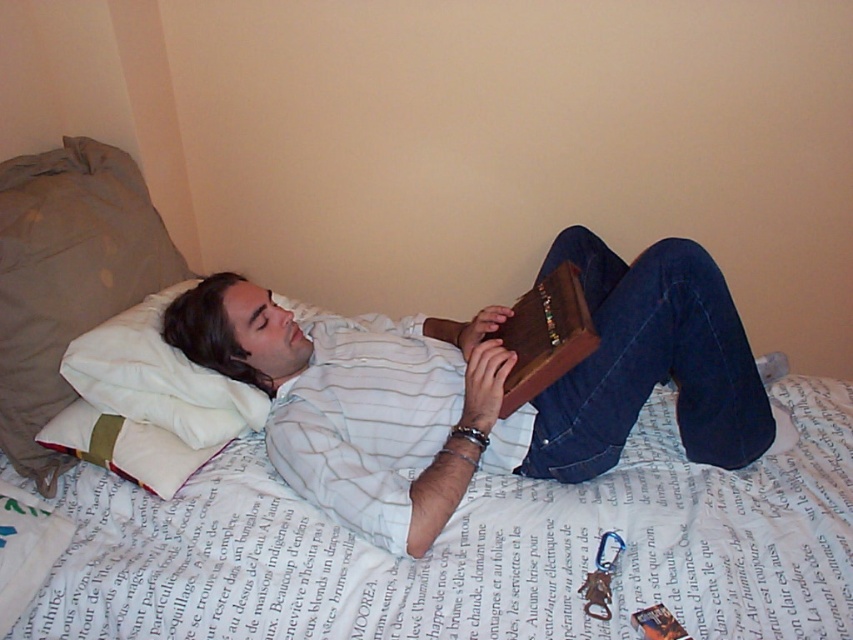
Between point (692, 324) and point (186, 396), which one is positioned behind?

The point (186, 396) is behind.

Consider the image. Between matte brown book at center and white soft pillow at upper left, which one is positioned lower?

Positioned lower is matte brown book at center.

Locate an element on the screen. The width and height of the screenshot is (853, 640). matte brown book at center is located at coordinates (480, 387).